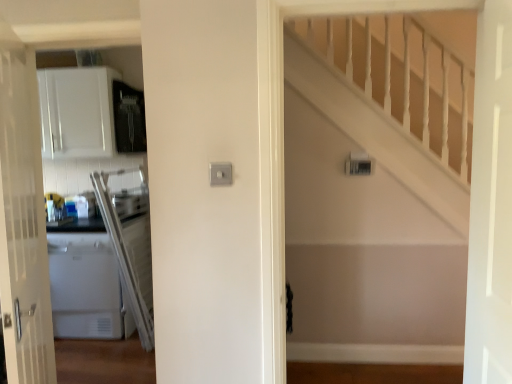
Question: Is white wooden staircase at upper right far away from white glossy door at left, which is the 1th door from left to right?

Choices:
 (A) yes
 (B) no

Answer: (A)

Question: From a real-world perspective, is white wooden staircase at upper right physically below white glossy door at left, which appears as the second door when viewed from the right?

Choices:
 (A) yes
 (B) no

Answer: (B)

Question: Does white wooden staircase at upper right come in front of white glossy door at left, which is the 1th door from left to right?

Choices:
 (A) no
 (B) yes

Answer: (A)

Question: From the image's perspective, is white wooden staircase at upper right on top of white glossy door at left, which is the 1th door from left to right?

Choices:
 (A) yes
 (B) no

Answer: (A)

Question: Is white wooden staircase at upper right further to camera compared to white glossy door at left, which appears as the second door when viewed from the right?

Choices:
 (A) no
 (B) yes

Answer: (B)

Question: Does white wooden staircase at upper right have a larger size compared to white glossy door at left, which appears as the second door when viewed from the right?

Choices:
 (A) no
 (B) yes

Answer: (B)

Question: Is white glossy door at left, which appears as the second door when viewed from the right, directly adjacent to white glossy door at right, the 2th door positioned from the left?

Choices:
 (A) yes
 (B) no

Answer: (B)

Question: From a real-world perspective, is white glossy door at left, which appears as the second door when viewed from the right, physically above white glossy door at right, the 2th door positioned from the left?

Choices:
 (A) no
 (B) yes

Answer: (A)

Question: Is white glossy door at left, which is the 1th door from left to right, positioned before white glossy door at right, the 2th door positioned from the left?

Choices:
 (A) yes
 (B) no

Answer: (B)

Question: From the image's perspective, is white glossy door at left, which is the 1th door from left to right, on white glossy door at right, arranged as the first door when viewed from the right?

Choices:
 (A) no
 (B) yes

Answer: (A)

Question: From a real-world perspective, is white glossy door at left, which appears as the second door when viewed from the right, positioned under white glossy door at right, arranged as the first door when viewed from the right, based on gravity?

Choices:
 (A) no
 (B) yes

Answer: (B)

Question: Does white glossy door at left, which appears as the second door when viewed from the right, contain white glossy door at right, arranged as the first door when viewed from the right?

Choices:
 (A) yes
 (B) no

Answer: (B)

Question: Considering the relative positions of white glossy door at right, arranged as the first door when viewed from the right, and white glossy door at left, which is the 1th door from left to right, in the image provided, is white glossy door at right, arranged as the first door when viewed from the right, to the left of white glossy door at left, which is the 1th door from left to right, from the viewer's perspective?

Choices:
 (A) no
 (B) yes

Answer: (A)